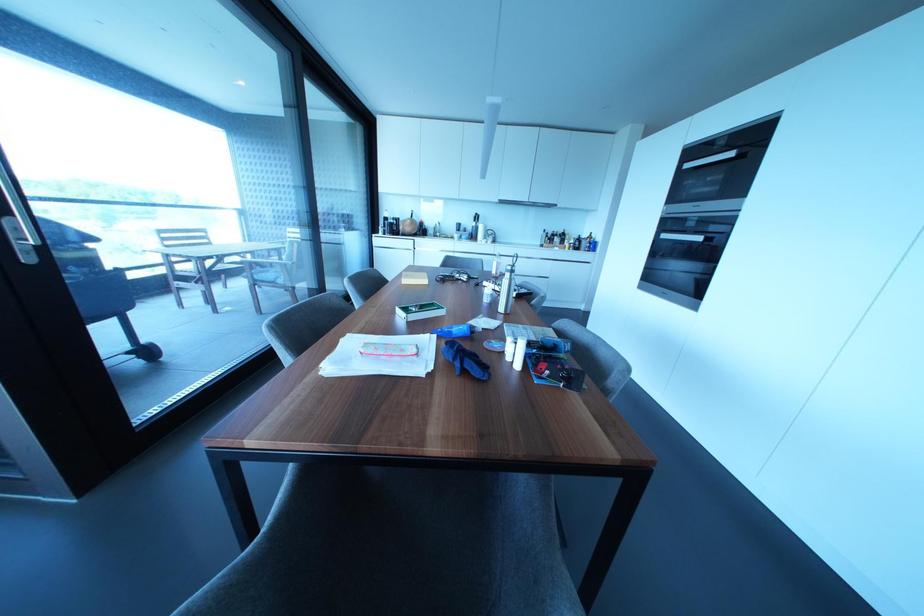
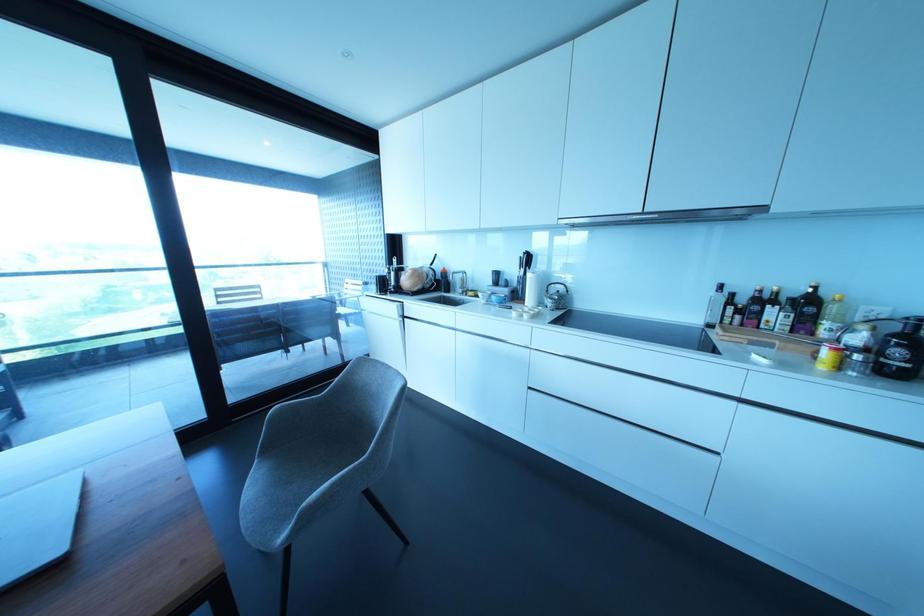
In the second image, find the point that corresponds to pixel 565 245 in the first image.

(825, 353)